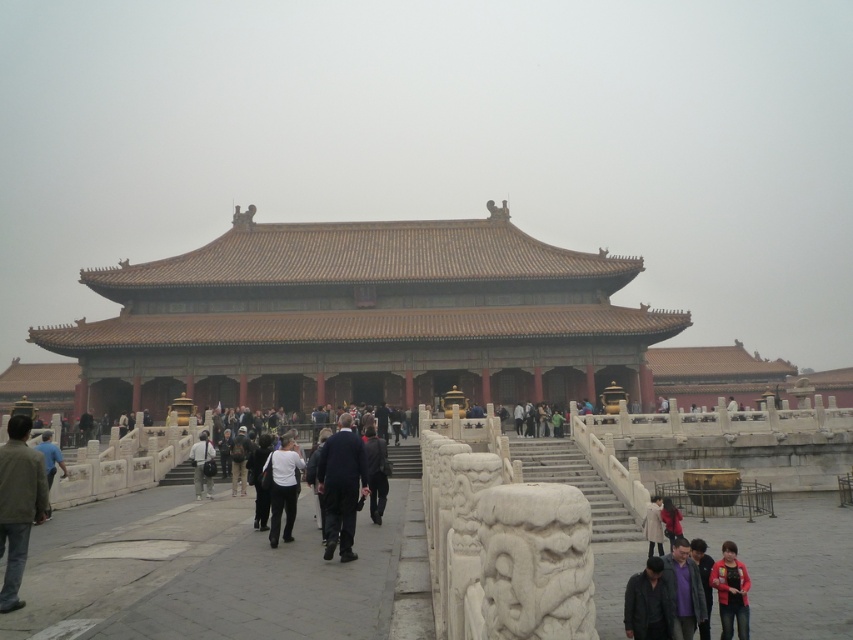
You are standing in the plaza in front of the building and want to take a photo of both the point at coordinates point (383, 250) and point (682, 630). Which point should you stand closer to ensure both are in the frame?

You should stand closer to point (682, 630) because it is further away from the camera than point (383, 250). By moving closer to the farther point, you can better include both points within the camera frame.